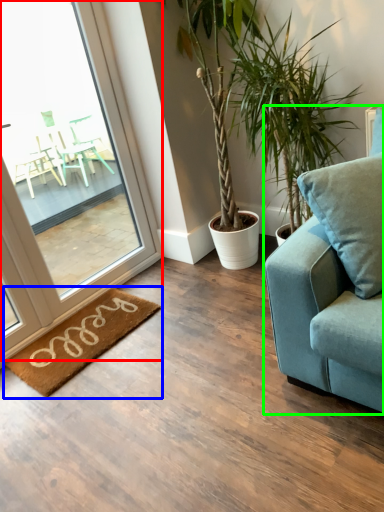
Question: Which object is the closest to the window (highlighted by a red box)? Choose among these: mat (highlighted by a blue box) or studio couch (highlighted by a green box).

Choices:
 (A) mat
 (B) studio couch

Answer: (A)